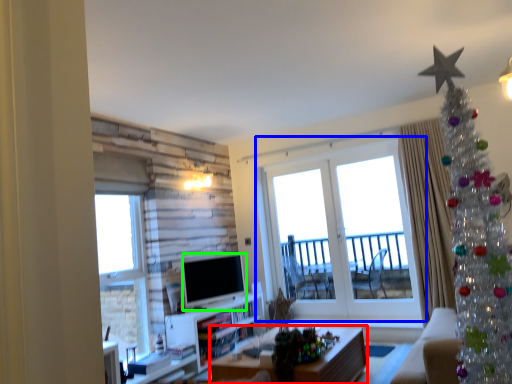
Question: Which object is positioned farthest from desk (highlighted by a red box)? Select from window (highlighted by a blue box) and television (highlighted by a green box).

Choices:
 (A) window
 (B) television

Answer: (A)